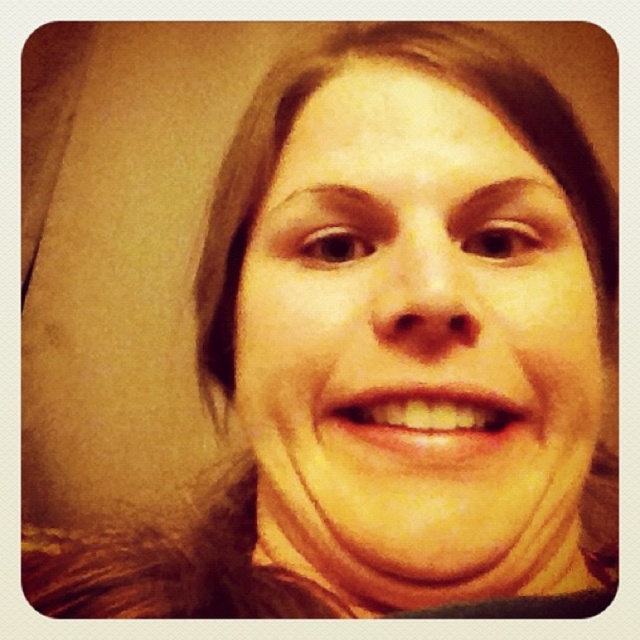
Question: Does smooth skin face at center have a lesser width compared to yellow matte teeth at center?

Choices:
 (A) yes
 (B) no

Answer: (B)

Question: Which of the following is the farthest from the observer?

Choices:
 (A) yellow matte teeth at center
 (B) smooth skin face at center

Answer: (A)

Question: Does smooth skin face at center have a larger size compared to yellow matte teeth at center?

Choices:
 (A) no
 (B) yes

Answer: (B)

Question: Which object is closer to the camera taking this photo?

Choices:
 (A) yellow matte teeth at center
 (B) smooth skin face at center

Answer: (B)

Question: Considering the relative positions of smooth skin face at center and yellow matte teeth at center in the image provided, where is smooth skin face at center located with respect to yellow matte teeth at center?

Choices:
 (A) below
 (B) above

Answer: (B)

Question: Which of the following is the closest to the observer?

Choices:
 (A) smooth skin face at center
 (B) yellow matte teeth at center

Answer: (A)